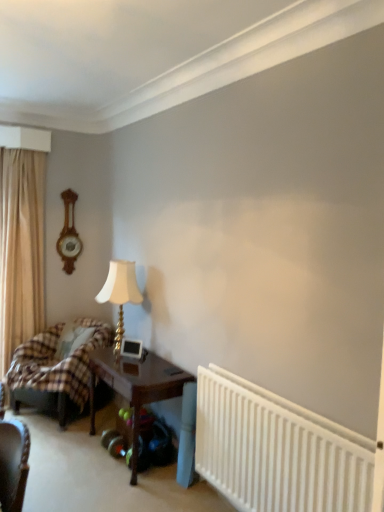
Question: Would you say gold metallic table lamp at center-left is to the left or to the right of plaid fabric bed at left in the picture?

Choices:
 (A) right
 (B) left

Answer: (A)

Question: Considering the positions of gold metallic table lamp at center-left and plaid fabric bed at left in the image, is gold metallic table lamp at center-left taller or shorter than plaid fabric bed at left?

Choices:
 (A) short
 (B) tall

Answer: (A)

Question: Which is nearer to the beige fabric curtain at left?

Choices:
 (A) gold metallic table lamp at center-left
 (B) wooden clock at left
 (C) plaid fabric bed at left
 (D) white plastic radiator at lower right
 (E) wooden table at center

Answer: (B)

Question: Which is farther from the white plastic radiator at lower right?

Choices:
 (A) plaid fabric bed at left
 (B) wooden clock at left
 (C) plaid fabric pillow at lower left
 (D) gold metallic table lamp at center-left
 (E) wooden table at center

Answer: (B)